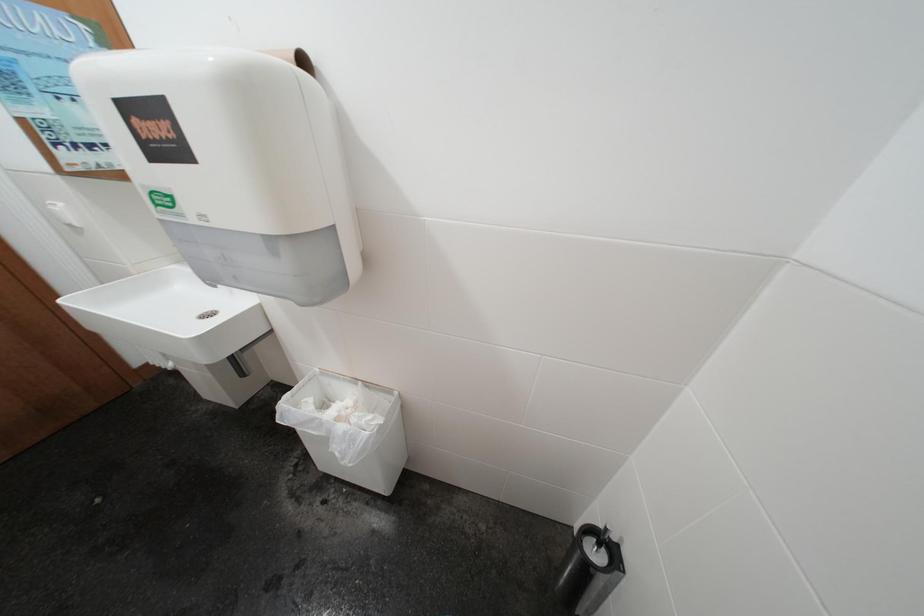
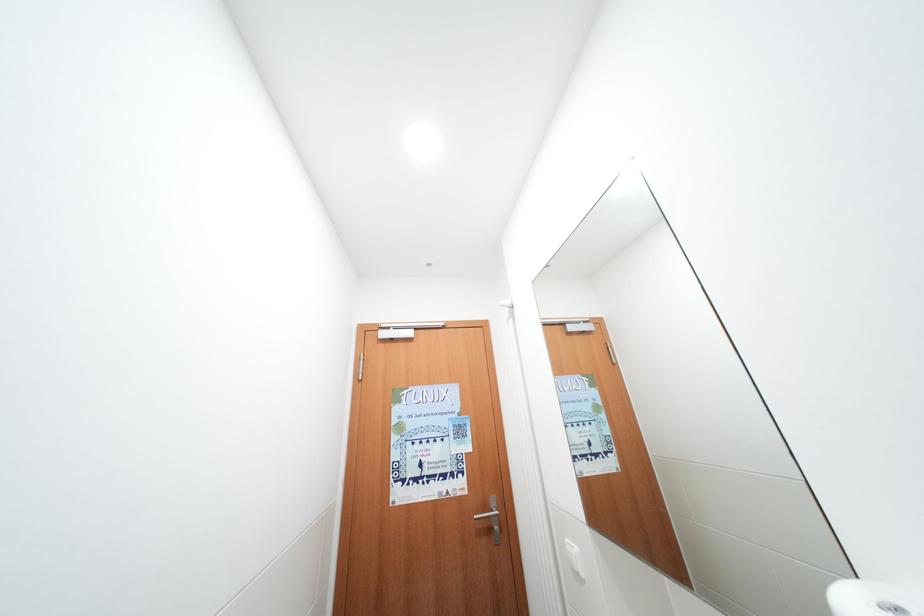
How did the camera likely rotate?

The rotation direction of the camera is left-up.